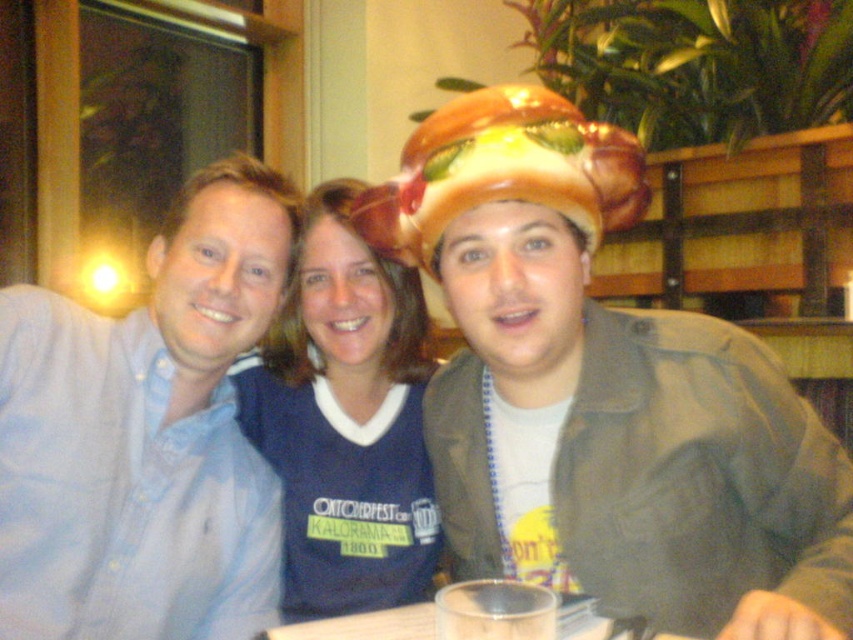
Between light blue button-down shirt at left and transparent plastic cup at center, which one is positioned higher?

light blue button-down shirt at left is above.

Does light blue button-down shirt at left have a smaller size compared to transparent plastic cup at center?

No, light blue button-down shirt at left is not smaller than transparent plastic cup at center.

Identify the location of light blue button-down shirt at left. This screenshot has width=853, height=640. (146, 435).

The height and width of the screenshot is (640, 853). Find the location of `light blue button-down shirt at left`. light blue button-down shirt at left is located at coordinates coord(146,435).

Does light blue button-down shirt at left have a smaller size compared to blue jersey at center?

No, light blue button-down shirt at left is not smaller than blue jersey at center.

Is light blue button-down shirt at left to the right of blue jersey at center from the viewer's perspective?

Incorrect, light blue button-down shirt at left is not on the right side of blue jersey at center.

Describe the element at coordinates (146, 435) in the screenshot. I see `light blue button-down shirt at left` at that location.

You are a GUI agent. You are given a task and a screenshot of the screen. Output one action in this format:
    pyautogui.click(x=<x>, y=<y>)
    Task: Click on the light blue button-down shirt at left
    This screenshot has height=640, width=853.
    Given the screenshot: What is the action you would take?
    pyautogui.click(x=146, y=435)

Can you confirm if matte plastic burger hat at center is bigger than light blue button-down shirt at left?

Yes.

Locate an element on the screen. matte plastic burger hat at center is located at coordinates (605, 392).